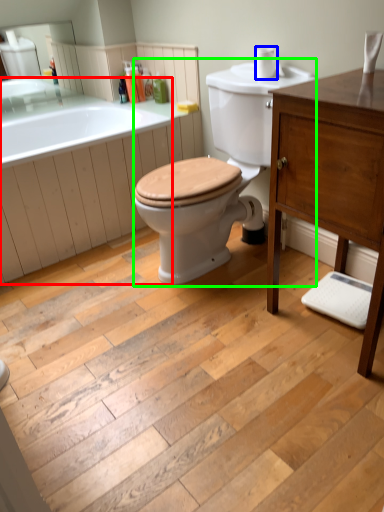
Question: Based on their relative distances, which object is farther from bath (highlighted by a red box)? Choose from toilet paper (highlighted by a blue box) and porcelain (highlighted by a green box).

Choices:
 (A) toilet paper
 (B) porcelain

Answer: (A)